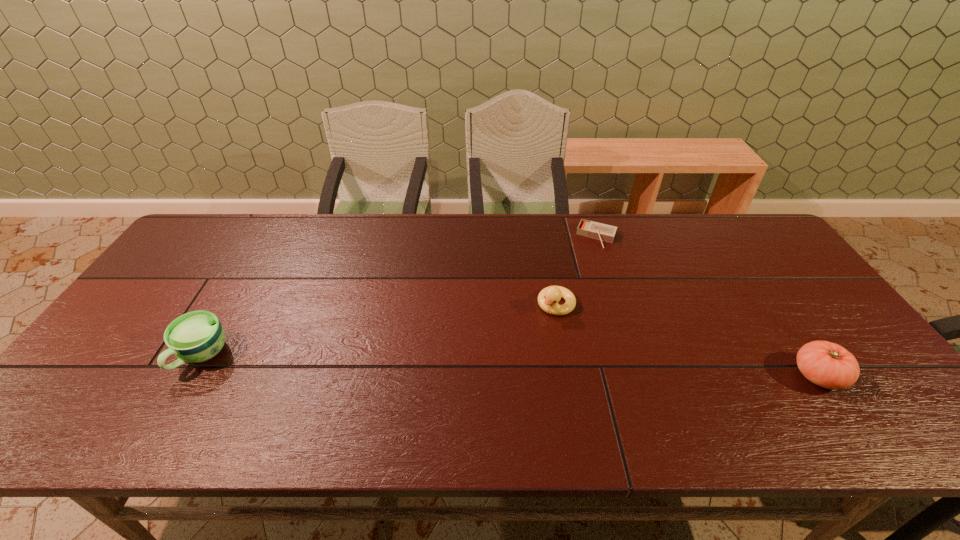
At what (x,y) coordinates should I click in order to perform the action: click on the leftmost object. Please return your answer as a coordinate pair (x, y). Looking at the image, I should click on (194, 337).

This screenshot has height=540, width=960. Find the location of `the rightmost object`. the rightmost object is located at coordinates (829, 365).

In order to click on matchbox in this screenshot , I will do `click(591, 229)`.

The height and width of the screenshot is (540, 960). Find the location of `the third object from left to right`. the third object from left to right is located at coordinates (591, 229).

In order to click on the third object from right to left in this screenshot , I will do `click(548, 298)`.

In order to click on the third nearest object in this screenshot , I will do `click(548, 298)`.

Find the location of `vacant space located 0.050m on the right of the cup`. vacant space located 0.050m on the right of the cup is located at coordinates (248, 356).

Find the location of a particular element. blank space located 0.070m on the back of the tomato is located at coordinates (789, 334).

Image resolution: width=960 pixels, height=540 pixels. I want to click on vacant area situated 0.400m on the striking surface of the farthest object, so click(x=558, y=335).

Image resolution: width=960 pixels, height=540 pixels. Identify the location of vacant region located on the striking surface of the farthest object. (567, 309).